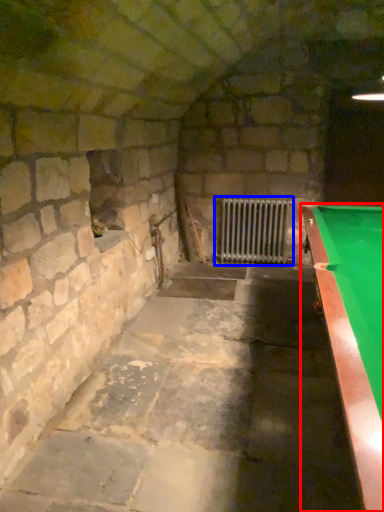
Question: Which object appears farthest to the camera in this image, billiard table (highlighted by a red box) or radiator (highlighted by a blue box)?

Choices:
 (A) billiard table
 (B) radiator

Answer: (B)